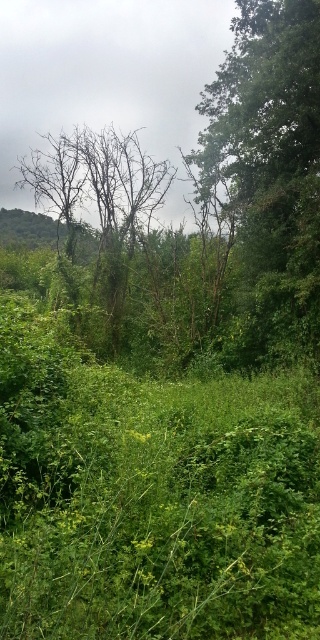
Question: Is green leafy tree at upper right further to camera compared to bare branches at center?

Choices:
 (A) yes
 (B) no

Answer: (B)

Question: Is green leafy tree at upper right bigger than bare branches at center?

Choices:
 (A) yes
 (B) no

Answer: (A)

Question: Which of the following is the closest to the observer?

Choices:
 (A) (288, 212)
 (B) (115, 237)

Answer: (A)

Question: Is green leafy tree at upper right behind bare branches at center?

Choices:
 (A) yes
 (B) no

Answer: (B)